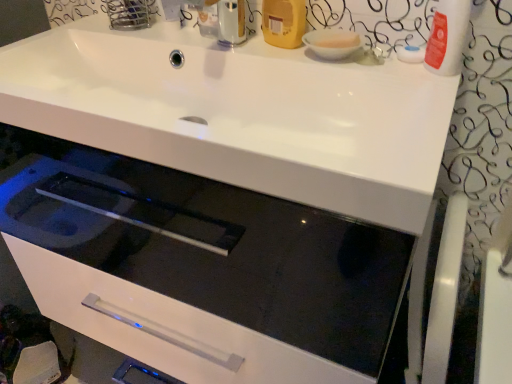
I want to click on free spot to the left of white ceramic bowl at upper right, so click(254, 49).